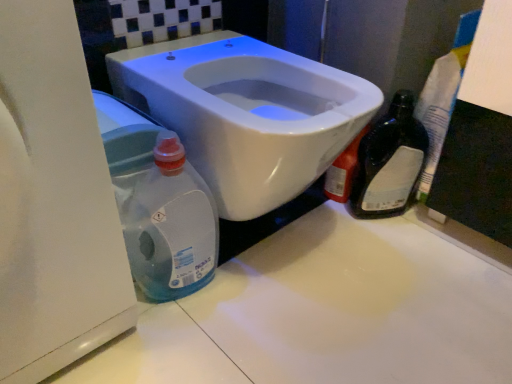
Question: Can you confirm if translucent plastic bottle at lower left is taller than white glossy counter top at center?

Choices:
 (A) yes
 (B) no

Answer: (A)

Question: Is translucent plastic bottle at lower left thinner than white glossy counter top at center?

Choices:
 (A) no
 (B) yes

Answer: (B)

Question: Is the position of translucent plastic bottle at lower left more distant than that of white glossy counter top at center?

Choices:
 (A) no
 (B) yes

Answer: (B)

Question: Is translucent plastic bottle at lower left bigger than white glossy counter top at center?

Choices:
 (A) yes
 (B) no

Answer: (B)

Question: Is translucent plastic bottle at lower left closer to camera compared to white glossy counter top at center?

Choices:
 (A) yes
 (B) no

Answer: (B)

Question: Considering the positions of point (249, 254) and point (133, 180), is point (249, 254) closer or farther from the camera than point (133, 180)?

Choices:
 (A) closer
 (B) farther

Answer: (B)

Question: Is white glossy counter top at center situated inside translucent plastic bottle at lower left or outside?

Choices:
 (A) inside
 (B) outside

Answer: (B)

Question: Is white glossy counter top at center bigger or smaller than translucent plastic bottle at lower left?

Choices:
 (A) small
 (B) big

Answer: (B)

Question: Relative to translucent plastic bottle at lower left, is white glossy counter top at center in front or behind?

Choices:
 (A) front
 (B) behind

Answer: (A)

Question: Do you think white glossy toilet at center is within translucent plastic bottle at lower left, or outside of it?

Choices:
 (A) outside
 (B) inside

Answer: (A)

Question: Is white glossy toilet at center bigger or smaller than translucent plastic bottle at lower left?

Choices:
 (A) big
 (B) small

Answer: (A)

Question: From a real-world perspective, is white glossy toilet at center above or below translucent plastic bottle at lower left?

Choices:
 (A) below
 (B) above

Answer: (B)

Question: Is white glossy toilet at center taller or shorter than translucent plastic bottle at lower left?

Choices:
 (A) tall
 (B) short

Answer: (A)

Question: Based on their positions, is black glass bottle at right located to the left or right of white glossy counter top at center?

Choices:
 (A) left
 (B) right

Answer: (B)

Question: Is black glass bottle at right taller or shorter than white glossy counter top at center?

Choices:
 (A) short
 (B) tall

Answer: (B)